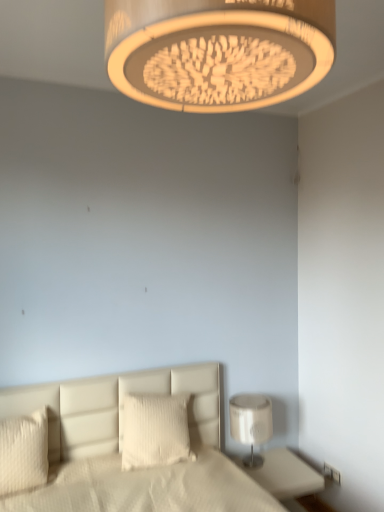
Locate an element on the screen. The height and width of the screenshot is (512, 384). vacant space situated above white glossy nightstand at lower right (from a real-world perspective) is located at coordinates (278, 460).